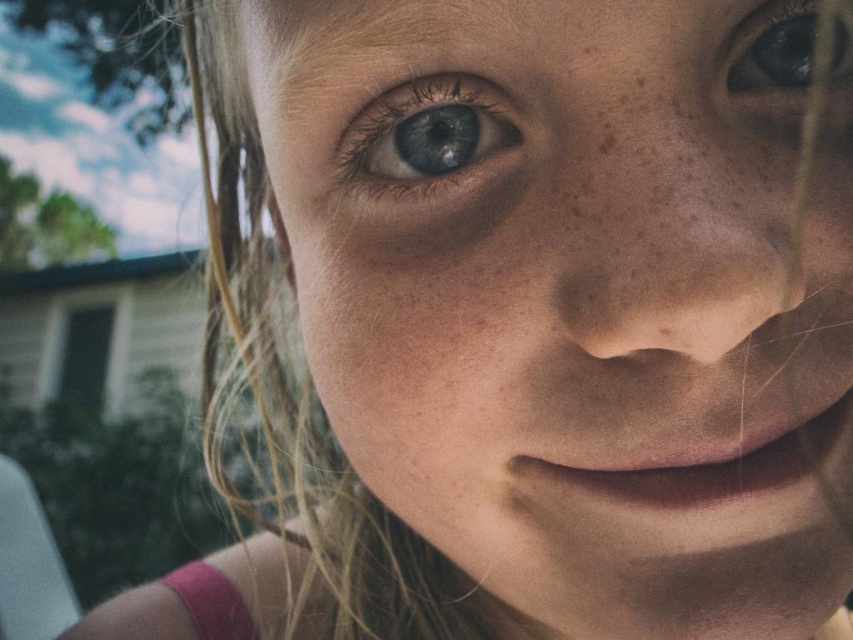
Measure the distance between smooth skin face at center and camera.

The distance of smooth skin face at center from camera is 9.00 inches.

Is smooth skin face at center wider than blue matte eye at center?

Correct, the width of smooth skin face at center exceeds that of blue matte eye at center.

Is point (408, 493) positioned before point (386, 97)?

No.

The image size is (853, 640). I want to click on smooth skin face at center, so click(566, 301).

Which is more to the right, smooth skin face at center or blue glossy eye at upper right?

blue glossy eye at upper right

Is smooth skin face at center above blue glossy eye at upper right?

No, smooth skin face at center is not above blue glossy eye at upper right.

Identify the location of smooth skin face at center. This screenshot has height=640, width=853. (566, 301).

The width and height of the screenshot is (853, 640). Identify the location of smooth skin face at center. (566, 301).

Can you confirm if blue matte eye at center is positioned to the left of blue glossy eye at upper right?

Yes, blue matte eye at center is to the left of blue glossy eye at upper right.

Which of these two, blue matte eye at center or blue glossy eye at upper right, stands taller?

blue matte eye at center is taller.

You are a GUI agent. You are given a task and a screenshot of the screen. Output one action in this format:
    pyautogui.click(x=<x>, y=<y>)
    Task: Click on the blue matte eye at center
    The image size is (853, 640).
    Given the screenshot: What is the action you would take?
    pyautogui.click(x=426, y=138)